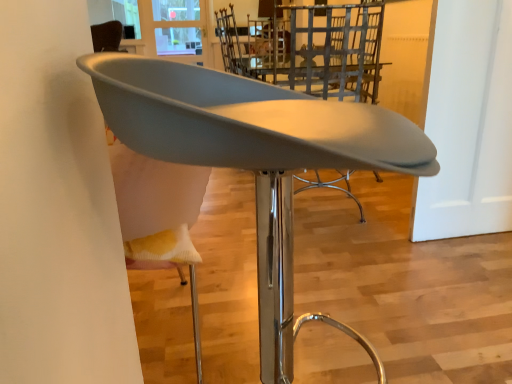
Question: From a real-world perspective, is matte gray chair at center, positioned as the second chair in back-to-front order, positioned under metallic silver chair at center, which appears as the second chair when viewed from the front, based on gravity?

Choices:
 (A) no
 (B) yes

Answer: (B)

Question: Considering the relative sizes of matte gray chair at center, the first chair from the front, and metallic silver chair at center, which appears as the second chair when viewed from the front, in the image provided, is matte gray chair at center, the first chair from the front, taller than metallic silver chair at center, which appears as the second chair when viewed from the front,?

Choices:
 (A) no
 (B) yes

Answer: (A)

Question: Can you confirm if matte gray chair at center, positioned as the second chair in back-to-front order, is shorter than metallic silver chair at center, which appears as the second chair when viewed from the front?

Choices:
 (A) no
 (B) yes

Answer: (B)

Question: Is the depth of matte gray chair at center, positioned as the second chair in back-to-front order, greater than that of metallic silver chair at center, which ranks as the 1th chair in back-to-front order?

Choices:
 (A) no
 (B) yes

Answer: (A)

Question: Is matte gray chair at center, positioned as the second chair in back-to-front order, oriented away from metallic silver chair at center, which appears as the second chair when viewed from the front?

Choices:
 (A) yes
 (B) no

Answer: (B)

Question: From a real-world perspective, is matte gray chair at center, positioned as the second chair in back-to-front order, above or below transparent glass window at upper center?

Choices:
 (A) above
 (B) below

Answer: (B)

Question: Is point (234, 79) closer or farther from the camera than point (163, 28)?

Choices:
 (A) farther
 (B) closer

Answer: (B)

Question: Considering their positions, is matte gray chair at center, positioned as the second chair in back-to-front order, located in front of or behind transparent glass window at upper center?

Choices:
 (A) behind
 (B) front

Answer: (B)

Question: Do you think matte gray chair at center, positioned as the second chair in back-to-front order, is within transparent glass window at upper center, or outside of it?

Choices:
 (A) outside
 (B) inside

Answer: (A)

Question: Visually, is transparent glass window at upper center positioned to the left or to the right of matte gray chair at center, the first chair from the front?

Choices:
 (A) right
 (B) left

Answer: (B)

Question: In terms of width, does transparent glass window at upper center look wider or thinner when compared to matte gray chair at center, positioned as the second chair in back-to-front order?

Choices:
 (A) thin
 (B) wide

Answer: (A)

Question: From the image's perspective, is transparent glass window at upper center positioned above or below matte gray chair at center, the first chair from the front?

Choices:
 (A) above
 (B) below

Answer: (A)

Question: Choose the correct answer: Is transparent glass window at upper center inside matte gray chair at center, positioned as the second chair in back-to-front order, or outside it?

Choices:
 (A) outside
 (B) inside

Answer: (A)

Question: Considering the relative positions of transparent glass window at upper center and metallic silver chair at center, which ranks as the 1th chair in back-to-front order, in the image provided, is transparent glass window at upper center to the left or to the right of metallic silver chair at center, which ranks as the 1th chair in back-to-front order,?

Choices:
 (A) right
 (B) left

Answer: (B)

Question: From a real-world perspective, is transparent glass window at upper center positioned above or below metallic silver chair at center, which ranks as the 1th chair in back-to-front order?

Choices:
 (A) above
 (B) below

Answer: (A)